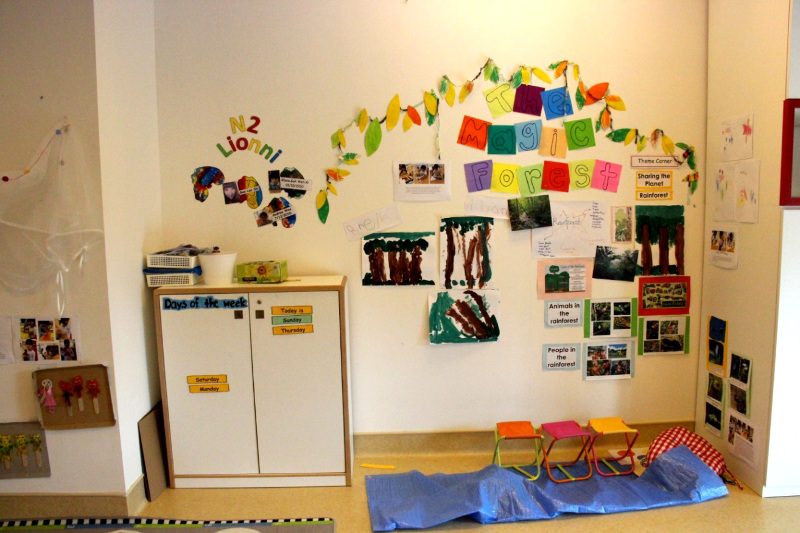
Locate an element on the screen. This screenshot has height=533, width=800. floor is located at coordinates (250, 500).